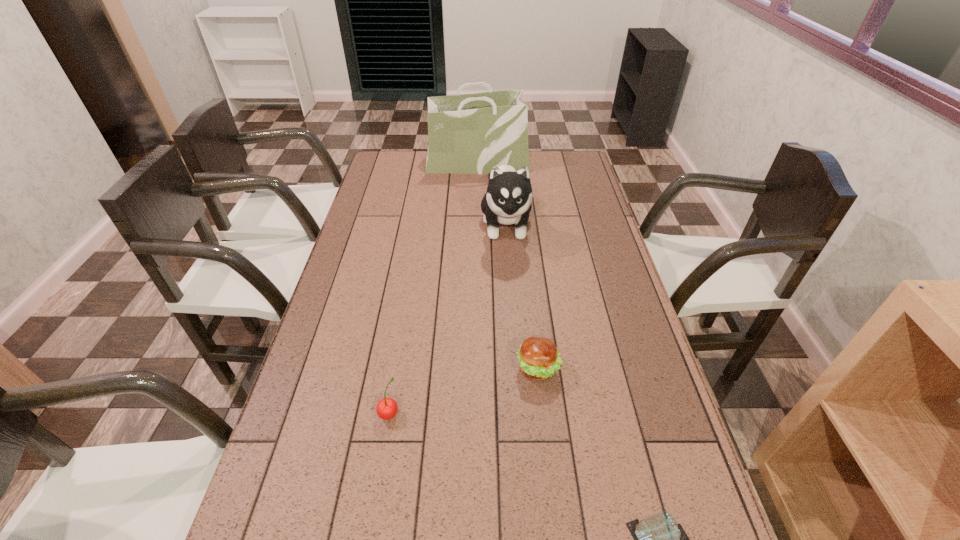
You are a GUI agent. You are given a task and a screenshot of the screen. Output one action in this format:
    pyautogui.click(x=<x>, y=<y>)
    Task: Click on the farthest object
    Image resolution: width=960 pixels, height=540 pixels.
    Given the screenshot: What is the action you would take?
    pyautogui.click(x=470, y=133)

What are the coordinates of `the tallest object` in the screenshot? It's located at (470, 133).

You are a GUI agent. You are given a task and a screenshot of the screen. Output one action in this format:
    pyautogui.click(x=<x>, y=<y>)
    Task: Click on the puppy
    This screenshot has height=540, width=960.
    Given the screenshot: What is the action you would take?
    pyautogui.click(x=508, y=198)

You are a GUI agent. You are given a task and a screenshot of the screen. Output one action in this format:
    pyautogui.click(x=<x>, y=<y>)
    Task: Click on the second farthest object
    
    Given the screenshot: What is the action you would take?
    pyautogui.click(x=508, y=198)

Locate an element on the screen. cherry is located at coordinates (387, 408).

I want to click on hamburger, so click(x=538, y=357).

Find the location of a particular element. The height and width of the screenshot is (540, 960). vacant space located on the right of the farthest object is located at coordinates (573, 163).

This screenshot has width=960, height=540. What are the coordinates of `free space located 0.300m at the face of the puppy` in the screenshot? It's located at (513, 323).

Identify the location of blank space located 0.400m on the right of the fourth farthest object. The width and height of the screenshot is (960, 540). (567, 413).

Find the location of `vacant space located 0.120m on the front of the hamburger`. vacant space located 0.120m on the front of the hamburger is located at coordinates (545, 432).